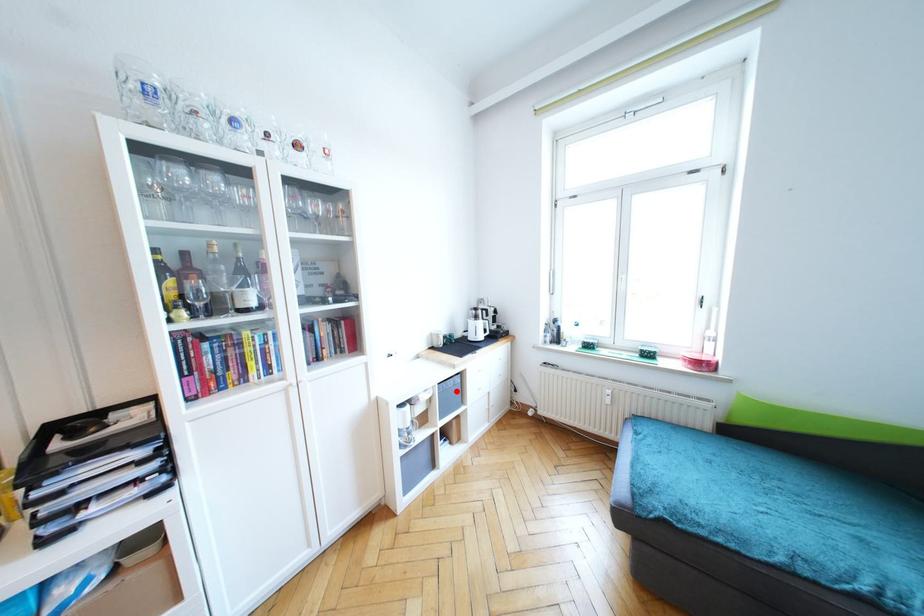
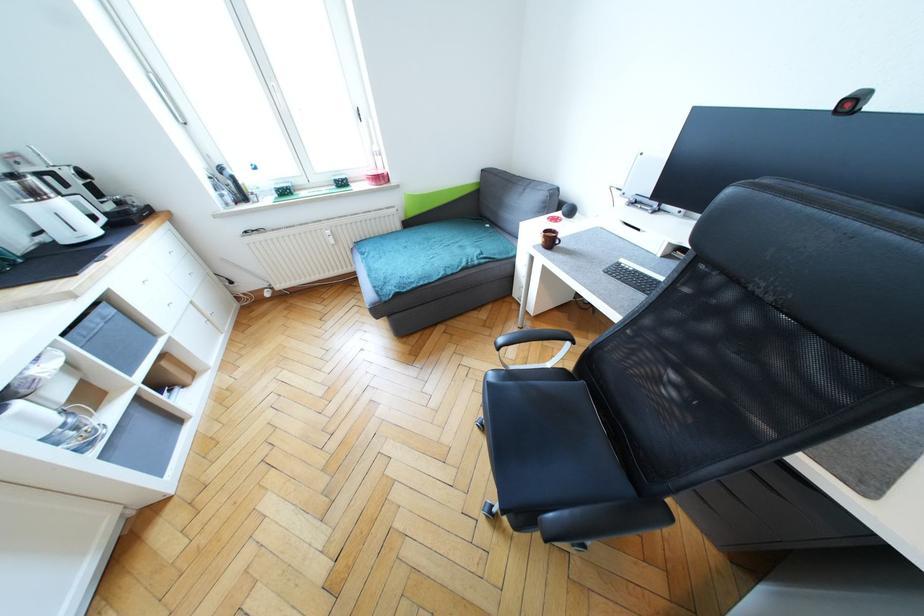
Question: I am providing you with two images of the same scene from different viewpoints. A red point is marked on the first image. Can you still see the location of the red point in image 2?

Choices:
 (A) Yes
 (B) No

Answer: (A)